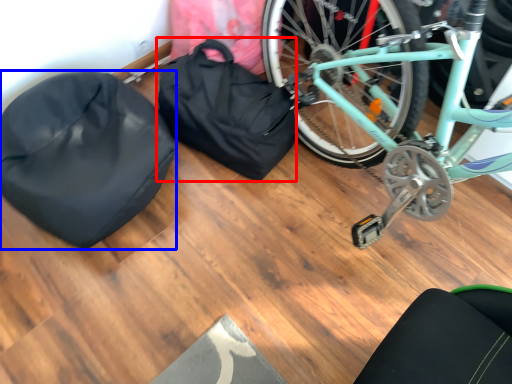
Question: Which of the following is the farthest to the observer, bag (highlighted by a red box) or sleeping bag (highlighted by a blue box)?

Choices:
 (A) bag
 (B) sleeping bag

Answer: (A)